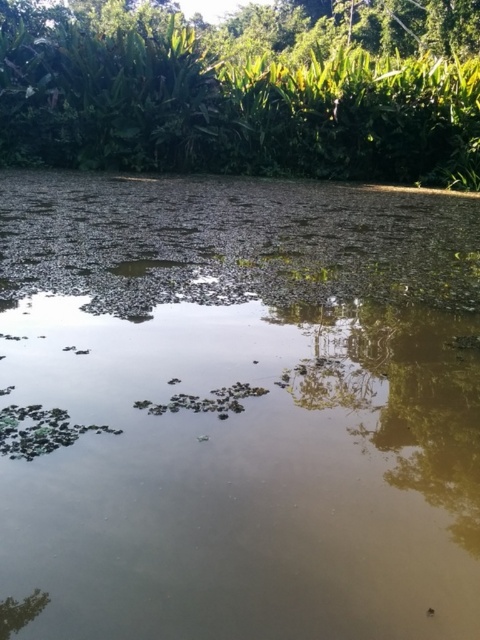
Question: Which of the following is the closest to the observer?

Choices:
 (A) brown murky water at center
 (B) green leafy trees at upper center

Answer: (A)

Question: Is brown murky water at center to the right of green leafy trees at upper center from the viewer's perspective?

Choices:
 (A) yes
 (B) no

Answer: (B)

Question: Is brown murky water at center to the right of green leafy trees at upper center from the viewer's perspective?

Choices:
 (A) no
 (B) yes

Answer: (A)

Question: Is brown murky water at center wider than green leafy trees at upper center?

Choices:
 (A) no
 (B) yes

Answer: (A)

Question: Which object appears farthest from the camera in this image?

Choices:
 (A) brown murky water at center
 (B) green leafy trees at upper center

Answer: (B)